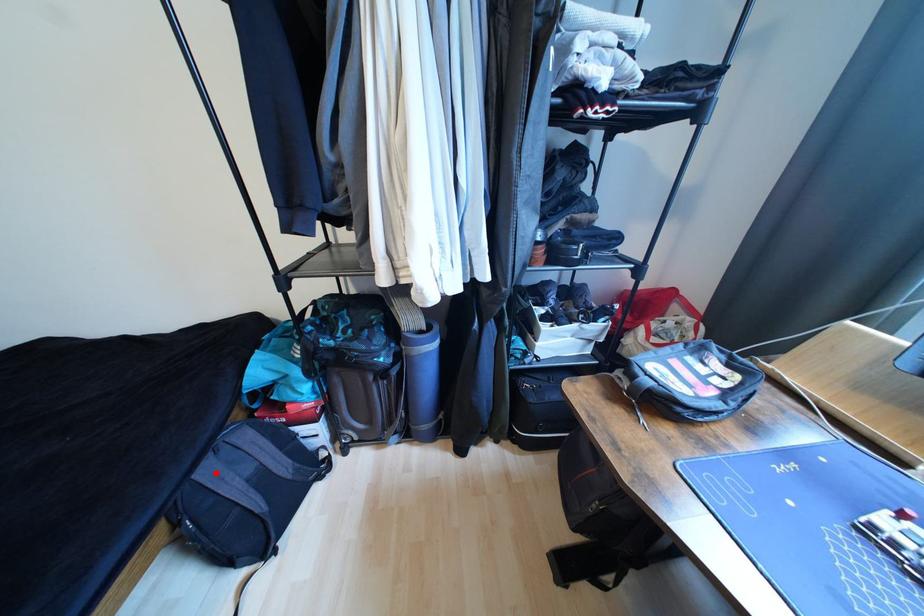
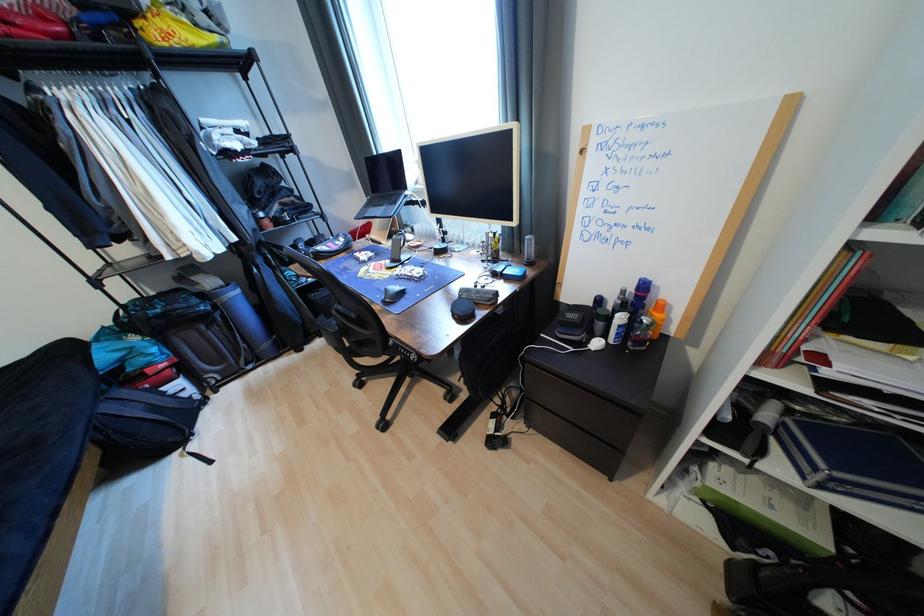
In the second image, find the point that corresponds to the highlighted location in the first image.

(116, 408)